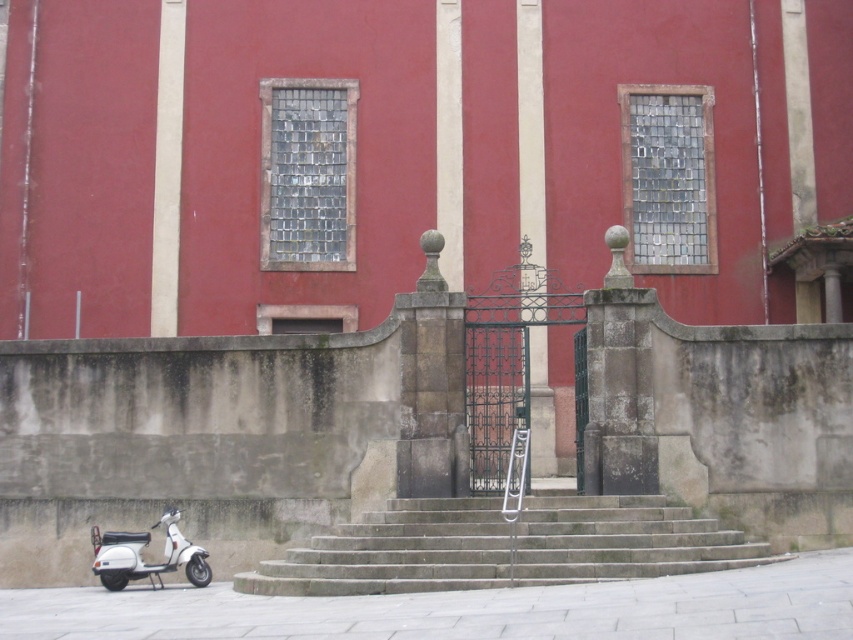
Question: Is gray stone stairs at center closer to camera compared to white matte scooter at lower left?

Choices:
 (A) yes
 (B) no

Answer: (A)

Question: Where is gray stone stairs at center located in relation to white matte scooter at lower left in the image?

Choices:
 (A) above
 (B) below

Answer: (A)

Question: Which point is farther to the camera?

Choices:
 (A) (453, 520)
 (B) (152, 564)

Answer: (B)

Question: Is gray stone stairs at center behind white matte scooter at lower left?

Choices:
 (A) no
 (B) yes

Answer: (A)